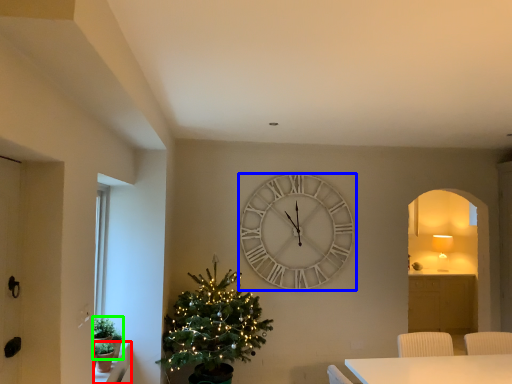
Question: Considering the real-world distances, which object is farthest from window sill (highlighted by a red box)? wall clock (highlighted by a blue box) or plant (highlighted by a green box)?

Choices:
 (A) wall clock
 (B) plant

Answer: (A)